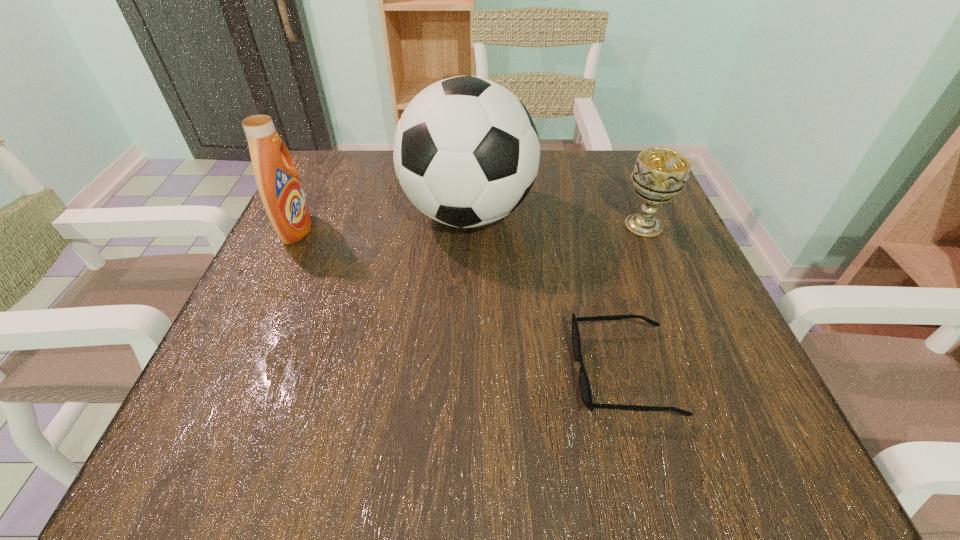
Image resolution: width=960 pixels, height=540 pixels. What are the coordinates of `vacant space that is in between the soccer ball and the leftmost object` in the screenshot? It's located at (382, 222).

At what (x,y) coordinates should I click in order to perform the action: click on vacant area that lies between the nearest object and the third object from right to left. Please return your answer as a coordinate pair (x, y). The image size is (960, 540). Looking at the image, I should click on (546, 293).

Find the location of a particular element. Image resolution: width=960 pixels, height=540 pixels. vacant area between the soccer ball and the leftmost object is located at coordinates (382, 222).

This screenshot has height=540, width=960. I want to click on free space that is in between the third object from right to left and the shortest object, so click(x=546, y=293).

Choose which object is the nearest neighbor to the leftmost object. Please provide its 2D coordinates. Your answer should be formatted as a tuple, i.e. [(x, y)], where the tuple contains the x and y coordinates of a point satisfying the conditions above.

[(466, 152)]

Find the location of a particular element. the second closest object to the leftmost object is located at coordinates (585, 389).

You are a GUI agent. You are given a task and a screenshot of the screen. Output one action in this format:
    pyautogui.click(x=<x>, y=<y>)
    Task: Click on the free spot that satisfies the following two spatial constraints: 1. on the front side of the second object from left to right; 2. on the right side of the chalice
    This screenshot has height=540, width=960.
    Given the screenshot: What is the action you would take?
    pyautogui.click(x=468, y=226)

Locate an element on the screen. The height and width of the screenshot is (540, 960). vacant point that satisfies the following two spatial constraints: 1. on the front side of the third tallest object; 2. on the front-facing side of the third object from left to right is located at coordinates (705, 372).